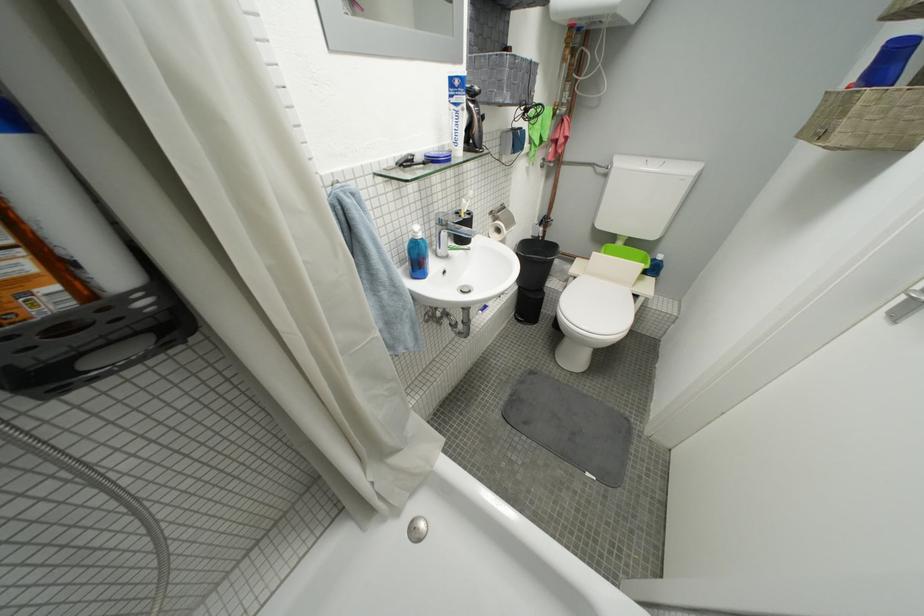
Find where to lift the black electric trimmer. Please return your answer as a coordinate pair (x, y).

(473, 121)